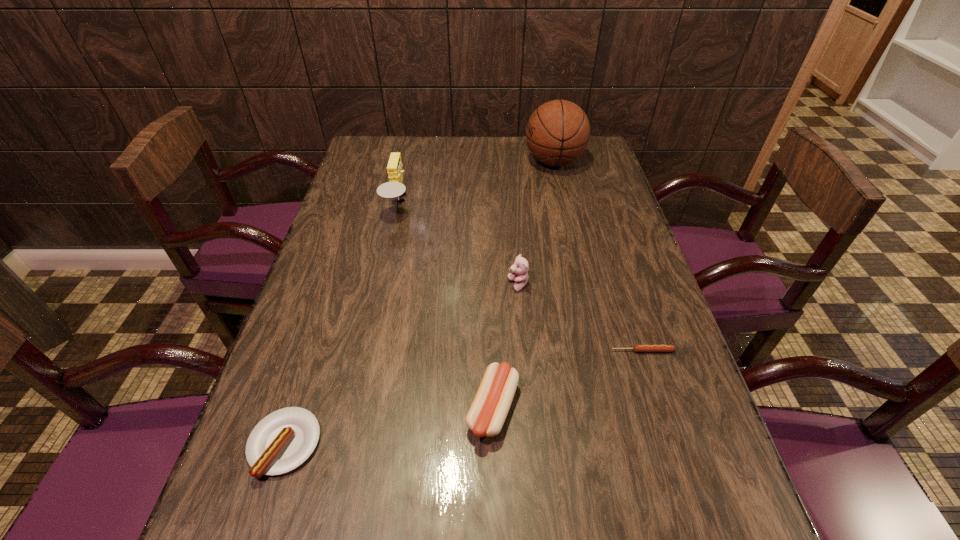
You are a GUI agent. You are given a task and a screenshot of the screen. Output one action in this format:
    pyautogui.click(x=<x>, y=<y>)
    Task: Click on the vacant space located 0.300m on the right of the leftmost object
    The width and height of the screenshot is (960, 540).
    Given the screenshot: What is the action you would take?
    pyautogui.click(x=484, y=444)

Where is `vacant space located 0.320m on the back of the shortest object`? The image size is (960, 540). vacant space located 0.320m on the back of the shortest object is located at coordinates (611, 250).

Identify the location of object at the far edge. (557, 133).

The width and height of the screenshot is (960, 540). I want to click on sponge at the left edge, so click(394, 188).

Where is `sausage positioned at the left edge`? The width and height of the screenshot is (960, 540). sausage positioned at the left edge is located at coordinates (283, 440).

In order to click on basketball at the right edge in this screenshot , I will do `click(557, 133)`.

Find the location of a particular element. sausage that is positioned at the right edge is located at coordinates (636, 348).

Find the location of a particular element. The width and height of the screenshot is (960, 540). object positioned at the far right corner is located at coordinates 557,133.

This screenshot has width=960, height=540. In order to click on free space at the far edge of the desktop in this screenshot , I will do `click(429, 140)`.

In the image, there is a desktop. Where is `vacant space at the left edge`? This screenshot has width=960, height=540. vacant space at the left edge is located at coordinates point(384,174).